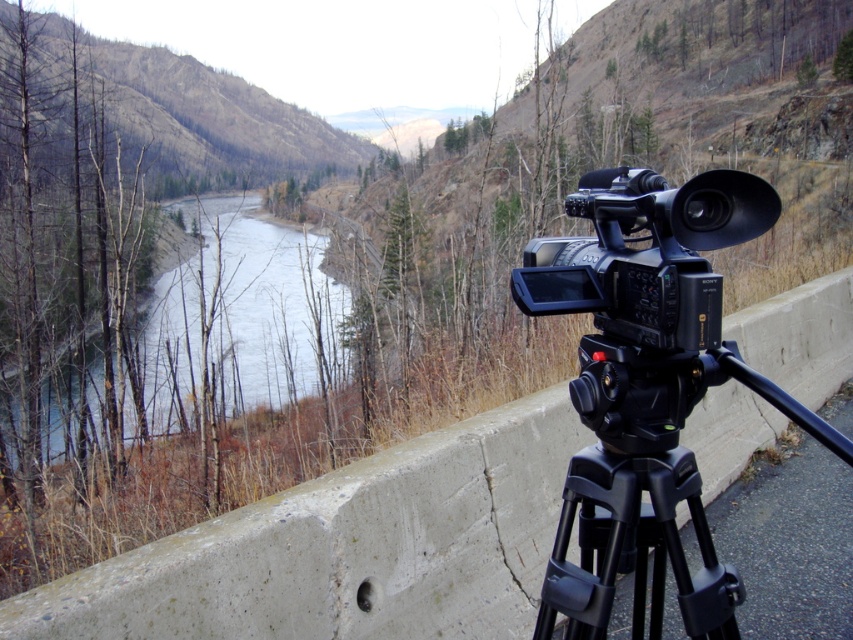
You are a photographer setting up equipment. You have a Sony camera on a tripod and notice the clear water at center and the black plastic tripod at lower right. Which object is closer to you?

The clear water at center is closer to you than the black plastic tripod at lower right because it is further to the viewer.

You are a photographer setting up equipment. You need to adjust the height of the black plastic camera at center so it can capture the scenic river view in the background. Based on the current setup, can you raise the camera higher by extending the legs of the black matte tripod at lower right?

The black matte tripod at lower right is located below the black plastic camera at center, so yes, you can raise the camera higher by extending the legs of the black matte tripod at lower right.

You are standing at the point labeled as point (x=347, y=547) in the image. What is the object you are standing on?

You are standing on the concrete ledge at center.